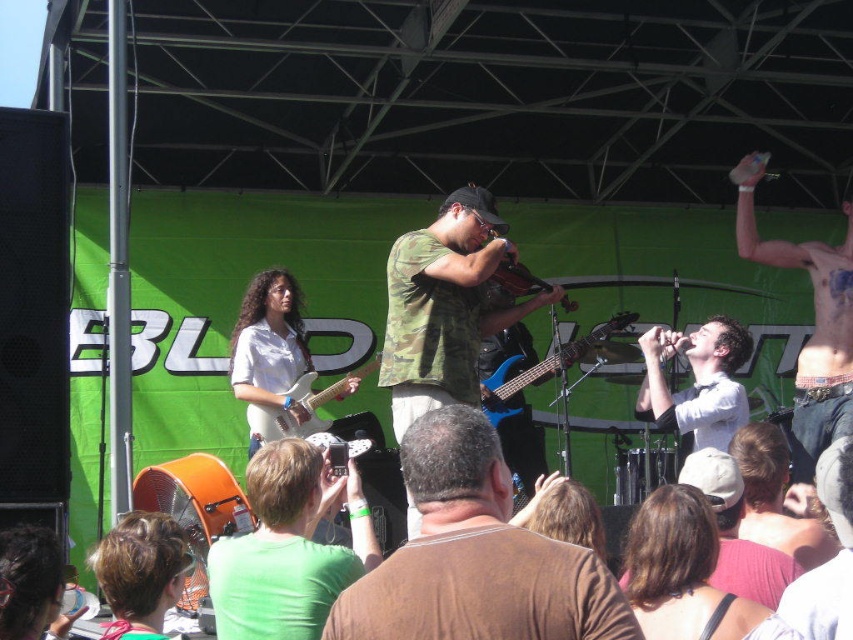
Question: Which of the following is the farthest from the observer?

Choices:
 (A) blue electric guitar at center
 (B) pink fabric at center

Answer: (A)

Question: Which object appears farthest from the camera in this image?

Choices:
 (A) wooden violin at center
 (B) pink fabric shirt at lower right

Answer: (A)

Question: In this image, where is green fabric shirt at center located relative to pink fabric shirt at lower right?

Choices:
 (A) left
 (B) right

Answer: (A)

Question: Is shiny metallic arm at upper right smaller than brown hair at lower center?

Choices:
 (A) yes
 (B) no

Answer: (B)

Question: Which point is closer to the camera?

Choices:
 (A) wooden violin at center
 (B) pink fabric at center
 (C) blue electric guitar at center

Answer: (B)

Question: Where is white shirt at center located in relation to pink fabric at center in the image?

Choices:
 (A) left
 (B) right

Answer: (B)